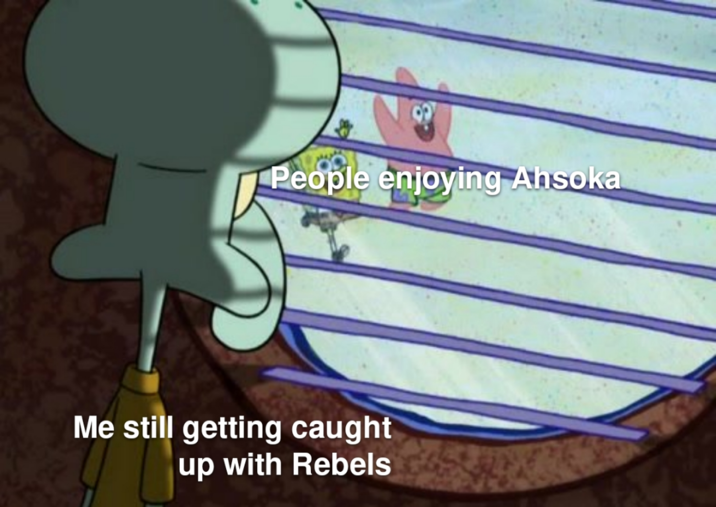
Identify the location of window. (414, 340).